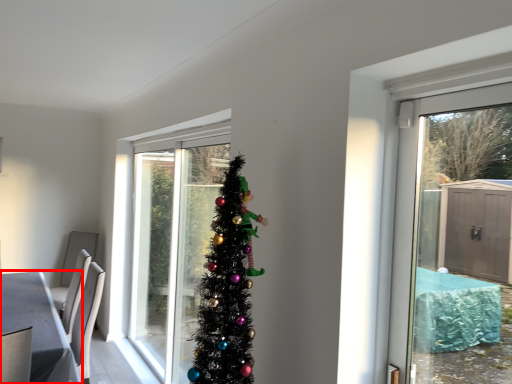
Question: In this image, where is table (annotated by the red box) located relative to door?

Choices:
 (A) left
 (B) right

Answer: (A)